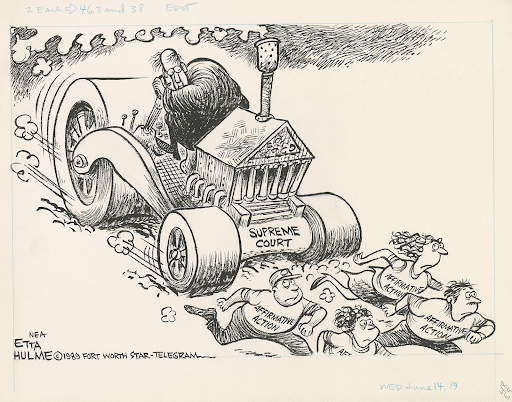
This screenshot has height=402, width=512. I want to click on pillars, so click(250, 182), click(264, 176), click(279, 177), click(291, 176), click(301, 176).